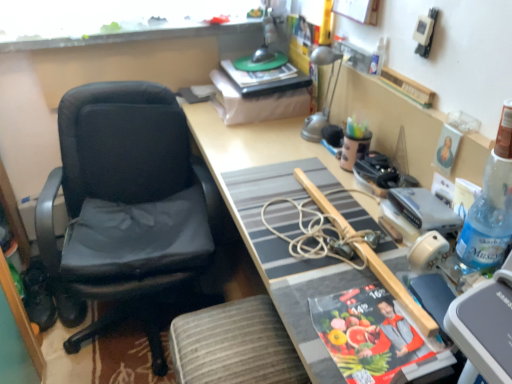
Question: Is metallic silver device at upper right a part of gray fabric stool at lower center?

Choices:
 (A) yes
 (B) no

Answer: (B)

Question: From the image's perspective, is gray fabric stool at lower center beneath metallic silver device at upper right?

Choices:
 (A) no
 (B) yes

Answer: (B)

Question: From a real-world perspective, is gray fabric stool at lower center under metallic silver device at upper right?

Choices:
 (A) yes
 (B) no

Answer: (A)

Question: Is gray fabric stool at lower center outside metallic silver device at upper right?

Choices:
 (A) yes
 (B) no

Answer: (A)

Question: Does gray fabric stool at lower center come in front of metallic silver device at upper right?

Choices:
 (A) yes
 (B) no

Answer: (B)

Question: Can you confirm if gray fabric stool at lower center is wider than metallic silver device at upper right?

Choices:
 (A) yes
 (B) no

Answer: (A)

Question: Is the depth of blue plastic bottle at right, the first bottle viewed from the right, greater than that of silver metallic lamp at upper right?

Choices:
 (A) no
 (B) yes

Answer: (A)

Question: From the image's perspective, does blue plastic bottle at right, the 1th bottle ordered from the bottom, appear lower than silver metallic lamp at upper right?

Choices:
 (A) no
 (B) yes

Answer: (B)

Question: Does blue plastic bottle at right, which is the second bottle from left to right, contain silver metallic lamp at upper right?

Choices:
 (A) no
 (B) yes

Answer: (A)

Question: Does blue plastic bottle at right, arranged as the 2th bottle when viewed from the back, have a greater width compared to silver metallic lamp at upper right?

Choices:
 (A) yes
 (B) no

Answer: (A)

Question: Is blue plastic bottle at right, arranged as the 2th bottle when viewed from the back, placed right next to silver metallic lamp at upper right?

Choices:
 (A) yes
 (B) no

Answer: (B)

Question: From a real-world perspective, is blue plastic bottle at right, which ranks as the first bottle in front-to-back order, located beneath silver metallic lamp at upper right?

Choices:
 (A) no
 (B) yes

Answer: (A)

Question: Is silver metallic lamp at upper right to the right of wooden desk at center from the viewer's perspective?

Choices:
 (A) yes
 (B) no

Answer: (A)